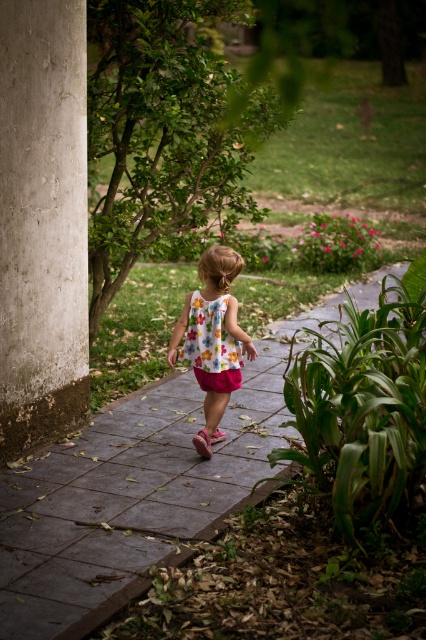
Who is more distant from viewer, (103, 429) or (25, 221)?

The point (103, 429) is behind.

Is gray concrete pavement at center closer to camera compared to concrete pillar at left?

Yes, it is.

Is point (120, 579) closer to camera compared to point (65, 60)?

Yes.

Locate an element on the screen. This screenshot has height=640, width=426. gray concrete pavement at center is located at coordinates (134, 493).

Between floral fabric dress at center and floral cotton dress at center, which one has less height?

floral cotton dress at center

Can you confirm if floral fabric dress at center is positioned below floral cotton dress at center?

Yes.

Is point (233, 384) less distant than point (218, 349)?

No, it is not.

Find the location of a particular element. floral fabric dress at center is located at coordinates (213, 339).

Who is shorter, gray concrete pavement at center or floral cotton dress at center?

Standing shorter between the two is floral cotton dress at center.

Does point (92, 552) come farther from viewer compared to point (192, 323)?

No, it is not.

Locate an element on the screen. The height and width of the screenshot is (640, 426). gray concrete pavement at center is located at coordinates (134, 493).